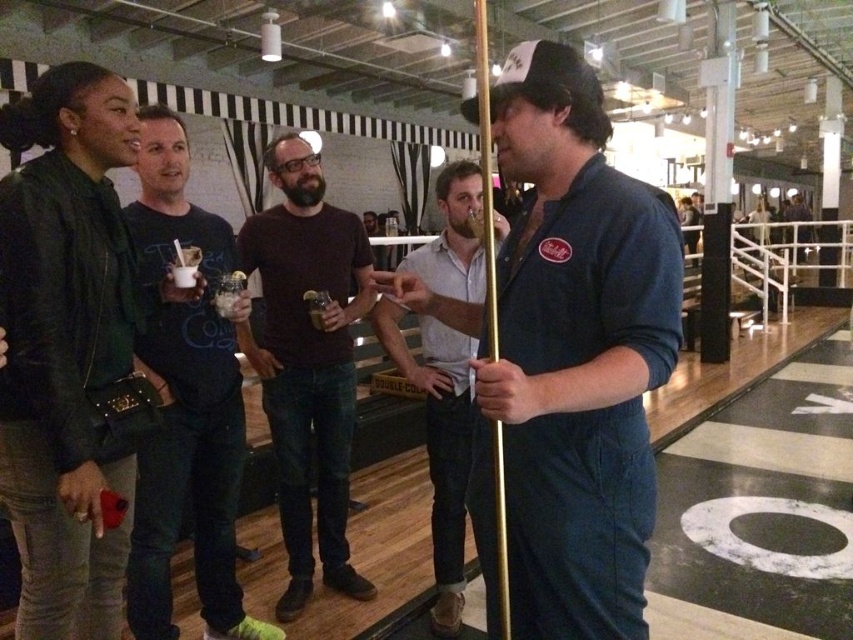
How distant is leather jacket at left from brown cotton shirt at center?

The distance of leather jacket at left from brown cotton shirt at center is 31.79 inches.

Describe the element at coordinates (65, 346) in the screenshot. I see `leather jacket at left` at that location.

Locate an element on the screen. leather jacket at left is located at coordinates (65, 346).

Identify the location of leather jacket at left. (65, 346).

Looking at this image, does leather jacket at left have a lesser width compared to light gray cotton shirt at center?

Yes.

Based on the photo, which is more to the right, leather jacket at left or light gray cotton shirt at center?

light gray cotton shirt at center

What are the coordinates of `leather jacket at left` in the screenshot? It's located at click(x=65, y=346).

What do you see at coordinates (576, 353) in the screenshot?
I see `denim jumpsuit at center` at bounding box center [576, 353].

Based on the photo, can you confirm if denim jumpsuit at center is positioned above brown cotton shirt at center?

Correct, denim jumpsuit at center is located above brown cotton shirt at center.

The height and width of the screenshot is (640, 853). What do you see at coordinates (576, 353) in the screenshot?
I see `denim jumpsuit at center` at bounding box center [576, 353].

Image resolution: width=853 pixels, height=640 pixels. I want to click on denim jumpsuit at center, so click(576, 353).